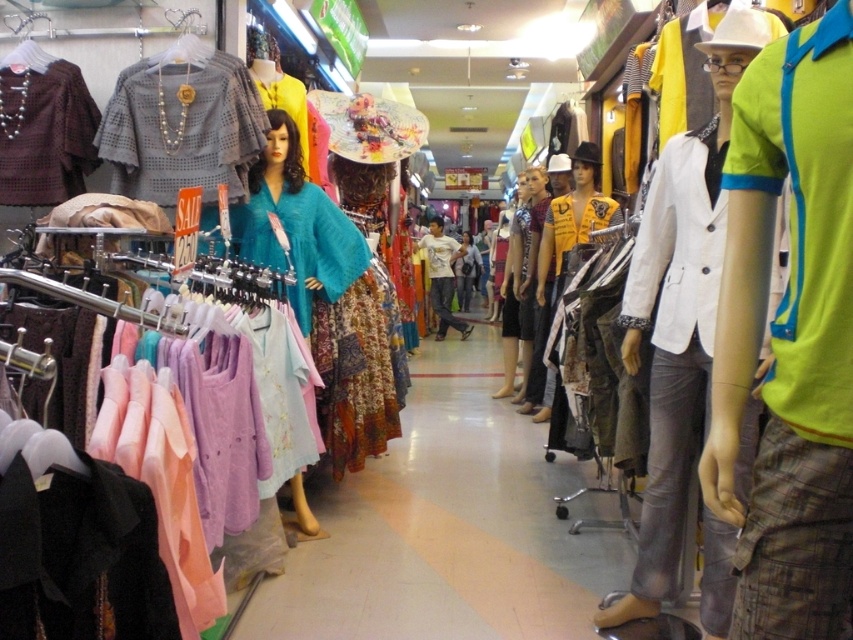
You are standing in the clothing store aisle and want to reach the point marked as point (674,541). There is an obstacle at point (730,433). Can you walk around it to get to your destination?

Point (730,433) is in front of point (674,541), so you need to navigate around the obstacle located at point (730,433) to reach your destination point (674,541).